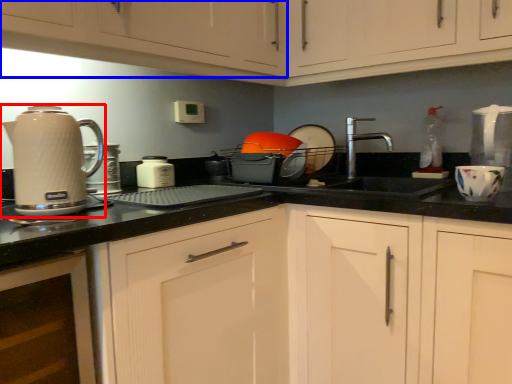
Question: Which of the following is the farthest to the observer, home appliance (highlighted by a red box) or cabinetry (highlighted by a blue box)?

Choices:
 (A) home appliance
 (B) cabinetry

Answer: (A)